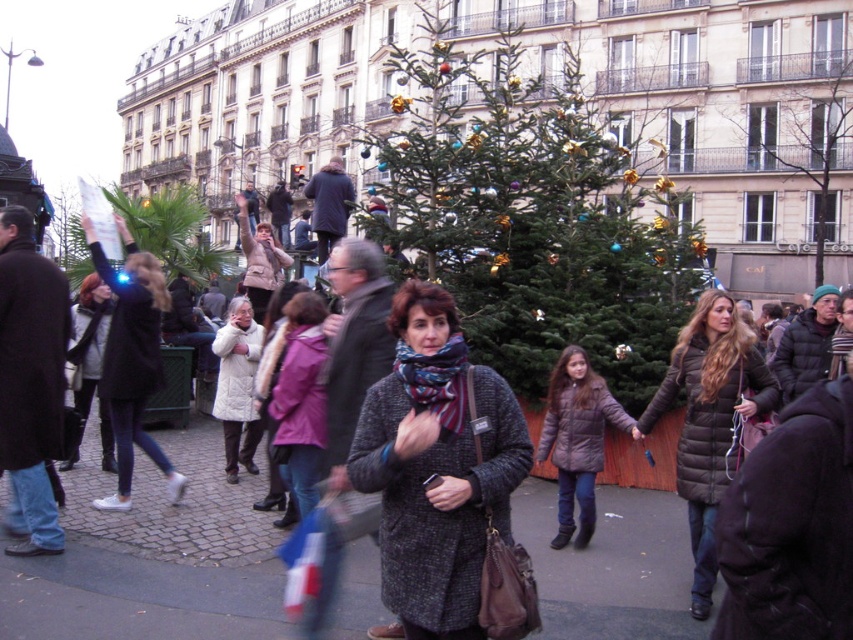
Describe the element at coordinates (532, 218) in the screenshot. I see `green matte christmas tree at center` at that location.

Which is below, green matte christmas tree at center or green matte tree at upper center?

Answer: green matte tree at upper center

Measure the distance between green matte christmas tree at center and camera.

The distance of green matte christmas tree at center from camera is 52.34 meters.

Find the location of a particular element. green matte christmas tree at center is located at coordinates (532, 218).

Is green matte christmas tree at center closer to camera compared to green matte christmas tree at upper center?

Yes.

Between green matte christmas tree at center and green matte christmas tree at upper center, which one is positioned lower?

green matte christmas tree at upper center is lower down.

In the scene shown: Who is more forward, (x=578, y=272) or (x=752, y=106)?

Positioned in front is point (x=578, y=272).

Where is `green matte christmas tree at center`? green matte christmas tree at center is located at coordinates (532, 218).

Does brown matte jacket at center come in front of green matte tree at upper center?

Yes, brown matte jacket at center is closer to the viewer.

Is brown matte jacket at center taller than green matte tree at upper center?

In fact, brown matte jacket at center may be shorter than green matte tree at upper center.

Between point (619, 422) and point (184, 232), which one is positioned in front?

Point (619, 422) is in front.

Locate an element on the screen. brown matte jacket at center is located at coordinates [577, 440].